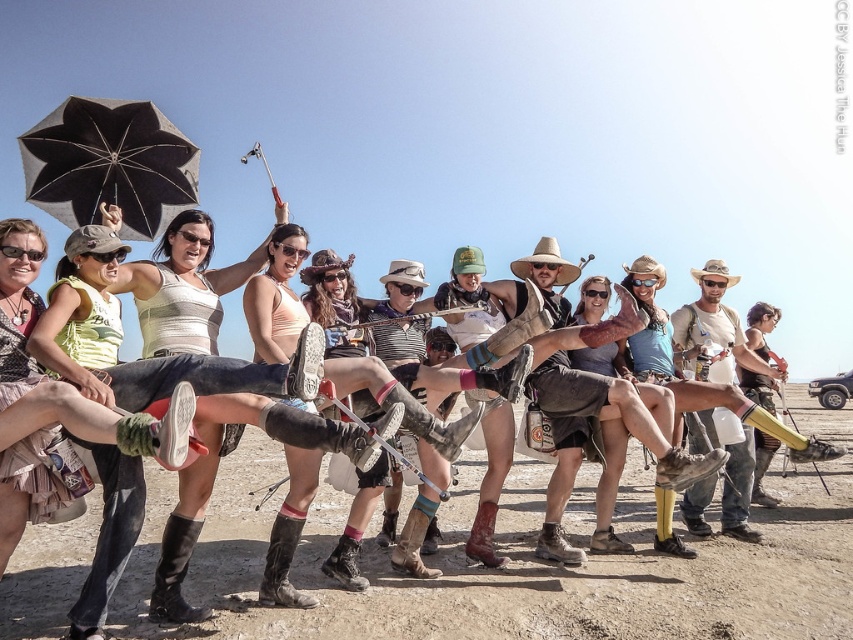
You are standing at the center of the image and looking towards the right side. There is a point marked at coordinate [759,326]. What object is located at this point?

The point at coordinate [759,326] corresponds to the matte black cowboy hat at right.

You are standing at the edge of the desert scene and see a point marked at coordinates (x=519, y=563). What is the surface type at that location?

The point at (x=519, y=563) is on dusty brown dirt at center.

You are standing in the desert and want to pick up the matte black cowboy hat at right and the brown leather boot at center. Which object is closer to you?

The matte black cowboy hat at right is closer to you because it is further to the viewer than the brown leather boot at center.